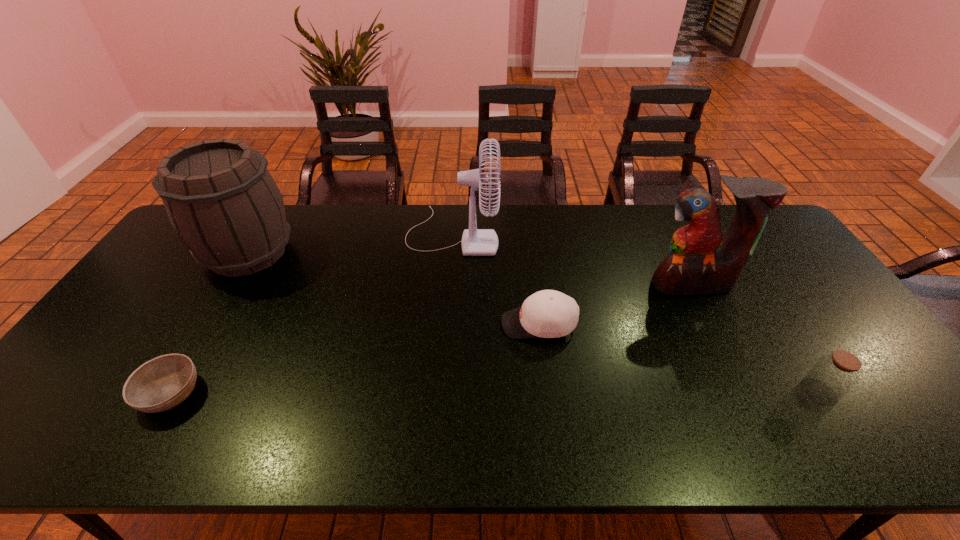
The width and height of the screenshot is (960, 540). What are the coordinates of `vacant space that satisfies the following two spatial constraints: 1. on the back side of the bowl; 2. on the right side of the third shortest object` in the screenshot? It's located at (171, 392).

Locate an element on the screen. The width and height of the screenshot is (960, 540). free space that satisfies the following two spatial constraints: 1. at the face of the parrot; 2. on the front-facing side of the fourth farthest object is located at coordinates (712, 324).

This screenshot has height=540, width=960. What are the coordinates of `vacant point that satisfies the following two spatial constraints: 1. on the front-facing side of the jar; 2. on the left side of the fan` in the screenshot? It's located at (441, 392).

Identify the location of free space in the image that satisfies the following two spatial constraints: 1. on the front-facing side of the second shortest object; 2. on the front side of the bowl. The image size is (960, 540). (547, 393).